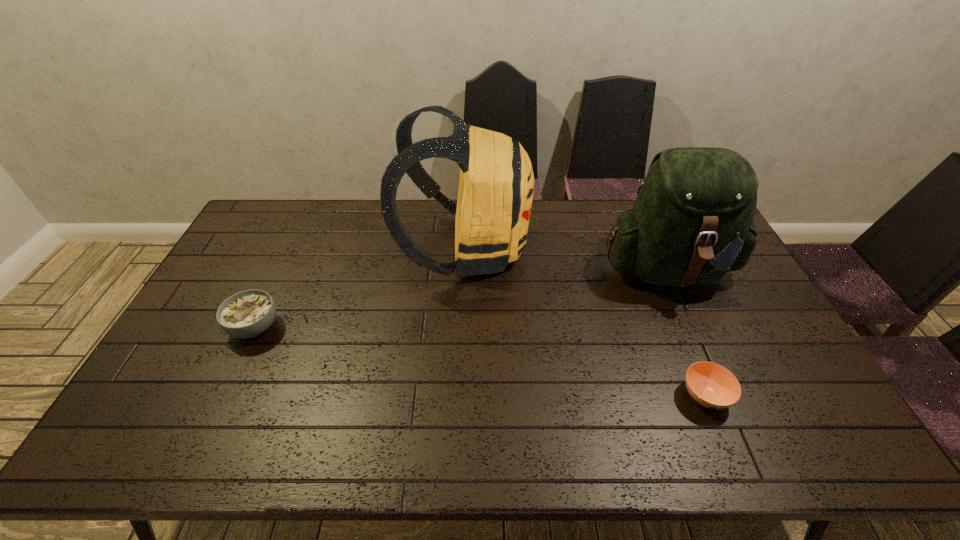
This screenshot has height=540, width=960. Identify the location of the left backpack. (495, 195).

Identify the location of the right backpack. Image resolution: width=960 pixels, height=540 pixels. (692, 222).

Where is `the leftmost object`? the leftmost object is located at coordinates (246, 314).

What are the coordinates of `the farther soup bowl` in the screenshot? It's located at (246, 314).

Identify the location of the shorter soup bowl. (711, 385).

Where is `the shortest object`? The image size is (960, 540). the shortest object is located at coordinates (711, 385).

This screenshot has width=960, height=540. What are the coordinates of `free region located on the front-facing side of the left backpack` in the screenshot? It's located at (586, 249).

What are the coordinates of `free space located on the open flap of the right backpack` in the screenshot? It's located at (715, 374).

I want to click on free space located 0.310m on the front of the leftmost object, so click(193, 457).

Locate an element on the screen. vacant space located on the right of the nearest object is located at coordinates point(788,396).